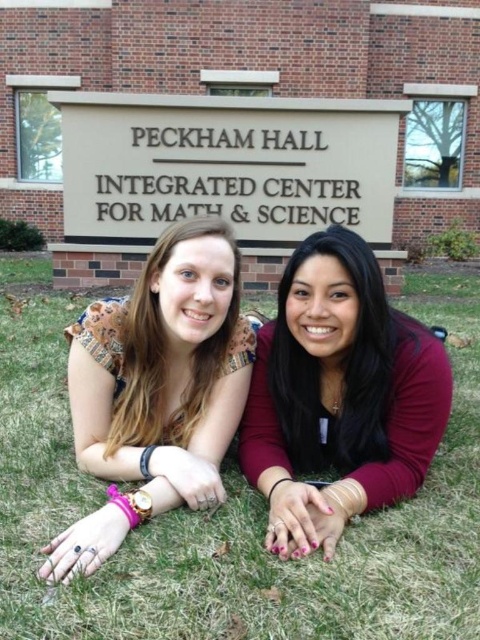
Question: Estimate the real-world distances between objects in this image. Which object is farther from the matte brown hair at center?

Choices:
 (A) multicolored fabric blouse at center
 (B) matte black shirt at center
 (C) maroon fabric shirt at center

Answer: (C)

Question: Among these points, which one is nearest to the camera?

Choices:
 (A) (290, 506)
 (B) (215, 548)
 (C) (136, 344)
 (D) (73, 346)

Answer: (B)

Question: Which of the following is the closest to the observer?

Choices:
 (A) (443, 449)
 (B) (175, 410)

Answer: (B)

Question: Does maroon fabric shirt at center appear under multicolored fabric blouse at center?

Choices:
 (A) yes
 (B) no

Answer: (B)

Question: Can you confirm if green grass at lower center is positioned to the left of maroon fabric shirt at center?

Choices:
 (A) no
 (B) yes

Answer: (B)

Question: Is green grass at lower center to the right of matte black shirt at center from the viewer's perspective?

Choices:
 (A) no
 (B) yes

Answer: (A)